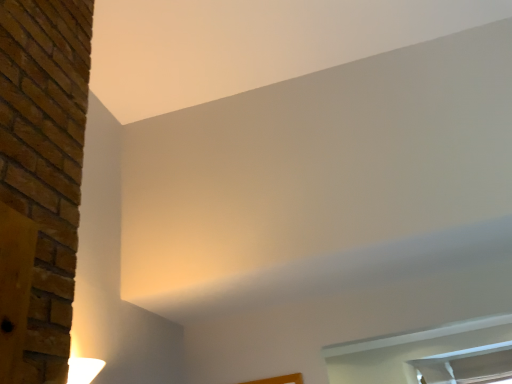
Question: Does clear glass window at lower right, which appears as the 1th window when viewed from the top, have a lesser height compared to clear glass window at lower right, marked as the first window in a bottom-to-top arrangement?

Choices:
 (A) no
 (B) yes

Answer: (B)

Question: Is clear glass window at lower right, which appears as the 1th window when viewed from the top, in front of clear glass window at lower right, the 2th window from the top?

Choices:
 (A) yes
 (B) no

Answer: (A)

Question: From the image's perspective, is clear glass window at lower right, acting as the second window starting from the bottom, located beneath clear glass window at lower right, the 2th window from the top?

Choices:
 (A) yes
 (B) no

Answer: (B)

Question: Does clear glass window at lower right, acting as the second window starting from the bottom, appear on the right side of clear glass window at lower right, the 2th window from the top?

Choices:
 (A) no
 (B) yes

Answer: (A)

Question: Does clear glass window at lower right, which appears as the 1th window when viewed from the top, have a larger size compared to clear glass window at lower right, the 2th window from the top?

Choices:
 (A) yes
 (B) no

Answer: (A)

Question: Is clear glass window at lower right, which appears as the 1th window when viewed from the top, looking in the opposite direction of clear glass window at lower right, marked as the first window in a bottom-to-top arrangement?

Choices:
 (A) yes
 (B) no

Answer: (B)

Question: Considering the relative sizes of clear glass window at lower right, the 2th window from the top, and clear glass window at lower right, acting as the second window starting from the bottom, in the image provided, is clear glass window at lower right, the 2th window from the top, shorter than clear glass window at lower right, acting as the second window starting from the bottom,?

Choices:
 (A) no
 (B) yes

Answer: (A)

Question: Is clear glass window at lower right, marked as the first window in a bottom-to-top arrangement, positioned in front of clear glass window at lower right, which appears as the 1th window when viewed from the top?

Choices:
 (A) no
 (B) yes

Answer: (A)

Question: From the image's perspective, is clear glass window at lower right, the 2th window from the top, on top of clear glass window at lower right, acting as the second window starting from the bottom?

Choices:
 (A) no
 (B) yes

Answer: (A)

Question: Does clear glass window at lower right, the 2th window from the top, lie behind clear glass window at lower right, which appears as the 1th window when viewed from the top?

Choices:
 (A) no
 (B) yes

Answer: (B)

Question: Considering the relative sizes of clear glass window at lower right, the 2th window from the top, and clear glass window at lower right, which appears as the 1th window when viewed from the top, in the image provided, is clear glass window at lower right, the 2th window from the top, smaller than clear glass window at lower right, which appears as the 1th window when viewed from the top,?

Choices:
 (A) yes
 (B) no

Answer: (A)

Question: Does clear glass window at lower right, marked as the first window in a bottom-to-top arrangement, have a greater width compared to clear glass window at lower right, acting as the second window starting from the bottom?

Choices:
 (A) yes
 (B) no

Answer: (B)

Question: Considering their positions, is clear glass window at lower right, acting as the second window starting from the bottom, located in front of or behind clear glass window at lower right, marked as the first window in a bottom-to-top arrangement?

Choices:
 (A) front
 (B) behind

Answer: (A)